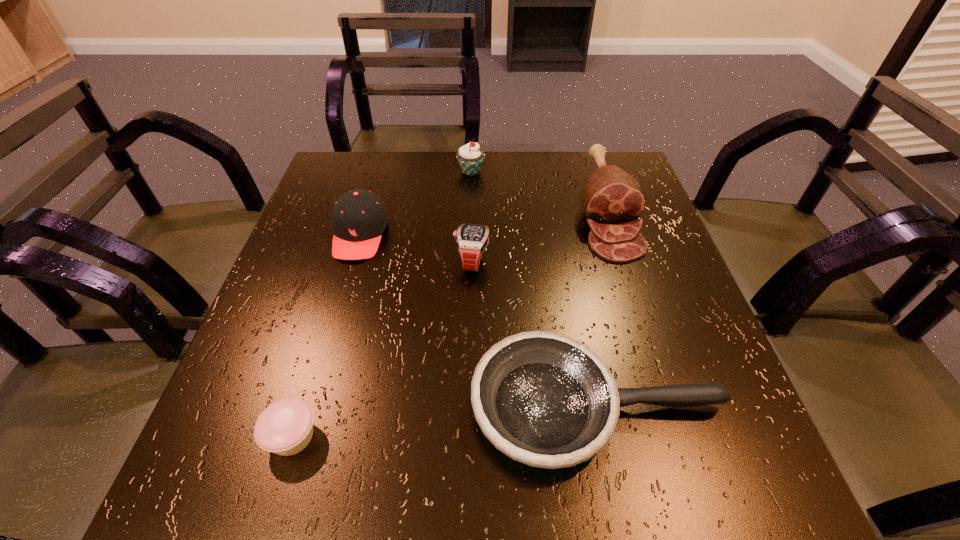
This screenshot has width=960, height=540. Identify the location of free spot between the cap and the ham. (483, 223).

At what (x,y) coordinates should I click in order to perform the action: click on free space between the taller cupcake and the frying pan. Please return your answer as a coordinate pair (x, y). Looking at the image, I should click on (534, 289).

Identify the location of free point between the cap and the watch. (416, 248).

Identify the location of free space between the right cupcake and the left cupcake. (382, 304).

Locate an element on the screen. The image size is (960, 540). vacant region between the frying pan and the left cupcake is located at coordinates (444, 422).

You are a GUI agent. You are given a task and a screenshot of the screen. Output one action in this format:
    pyautogui.click(x=<x>, y=<y>)
    Task: Click on the free space between the farther cupcake and the cap
    
    Given the screenshot: What is the action you would take?
    pyautogui.click(x=416, y=203)

At what (x,y) coordinates should I click in order to perform the action: click on free point between the cap and the farther cupcake. Please return your answer as a coordinate pair (x, y). Looking at the image, I should click on (416, 203).

Find the location of a particular element. The image size is (960, 540). free space that is in between the frying pan and the cap is located at coordinates (478, 321).

Where is `the third closest object to the shorter cupcake`? the third closest object to the shorter cupcake is located at coordinates (472, 240).

Locate which object is the fourth closest to the cap. Please provide its 2D coordinates. Your answer should be formatted as a tuple, i.e. [(x, y)], where the tuple contains the x and y coordinates of a point satisfying the conditions above.

[(285, 427)]